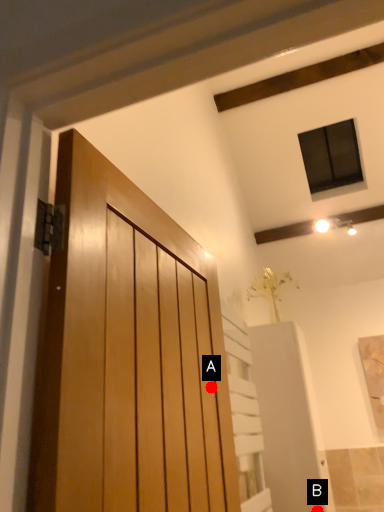
Question: Two points are circled on the image, labeled by A and B beside each circle. Which point is farther to the camera?

Choices:
 (A) A is further
 (B) B is further

Answer: (B)